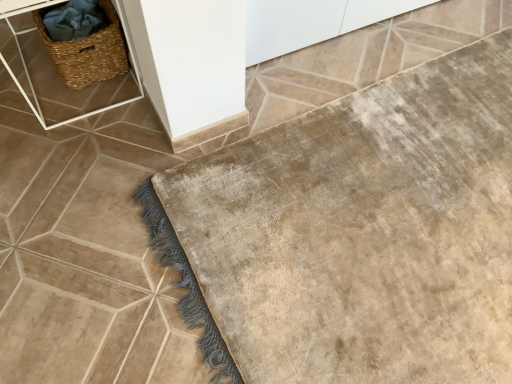
Question: Can you confirm if beige plush bath mat at lower right is bigger than woven brown picnic basket at upper left?

Choices:
 (A) no
 (B) yes

Answer: (B)

Question: Is beige plush bath mat at lower right at the left side of woven brown picnic basket at upper left?

Choices:
 (A) yes
 (B) no

Answer: (B)

Question: Is beige plush bath mat at lower right outside woven brown picnic basket at upper left?

Choices:
 (A) yes
 (B) no

Answer: (A)

Question: Is beige plush bath mat at lower right in front of woven brown picnic basket at upper left?

Choices:
 (A) no
 (B) yes

Answer: (B)

Question: Does beige plush bath mat at lower right turn towards woven brown picnic basket at upper left?

Choices:
 (A) yes
 (B) no

Answer: (B)

Question: Is beige plush bath mat at lower right in front of or behind woven straw basket at upper left in the image?

Choices:
 (A) front
 (B) behind

Answer: (A)

Question: From the image's perspective, is beige plush bath mat at lower right above or below woven straw basket at upper left?

Choices:
 (A) below
 (B) above

Answer: (A)

Question: Looking at the image, does beige plush bath mat at lower right seem bigger or smaller compared to woven straw basket at upper left?

Choices:
 (A) big
 (B) small

Answer: (B)

Question: Looking at their shapes, would you say beige plush bath mat at lower right is wider or thinner than woven straw basket at upper left?

Choices:
 (A) wide
 (B) thin

Answer: (A)

Question: From a real-world perspective, is woven brown picnic basket at upper left above or below woven straw basket at upper left?

Choices:
 (A) above
 (B) below

Answer: (B)

Question: Looking at their shapes, would you say woven brown picnic basket at upper left is wider or thinner than woven straw basket at upper left?

Choices:
 (A) wide
 (B) thin

Answer: (B)

Question: Based on their sizes in the image, would you say woven brown picnic basket at upper left is bigger or smaller than woven straw basket at upper left?

Choices:
 (A) big
 (B) small

Answer: (B)

Question: Is point (111, 36) positioned closer to the camera than point (115, 11)?

Choices:
 (A) closer
 (B) farther

Answer: (B)

Question: Is point pyautogui.click(x=79, y=84) positioned closer to the camera than point pyautogui.click(x=62, y=49)?

Choices:
 (A) farther
 (B) closer

Answer: (A)

Question: Considering their positions, is woven straw basket at upper left located in front of or behind woven brown picnic basket at upper left?

Choices:
 (A) behind
 (B) front

Answer: (B)